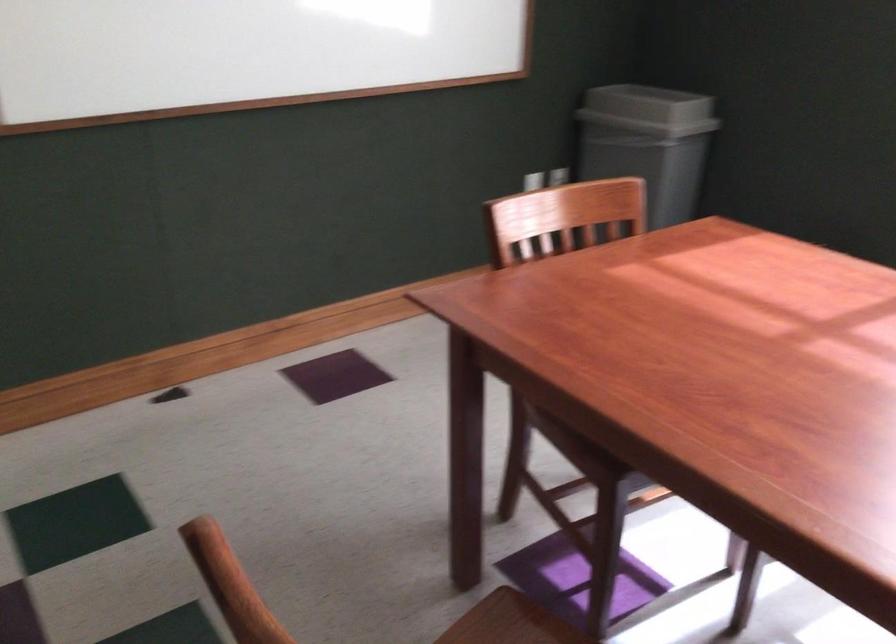
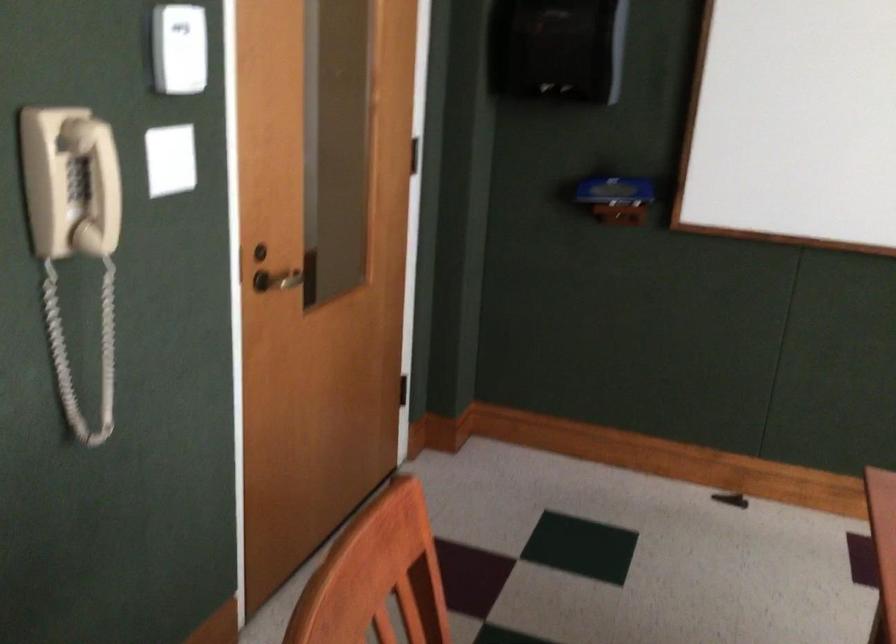
Question: The first image is from the beginning of the video and the second image is from the end. How did the camera likely rotate when shooting the video?

Choices:
 (A) Left
 (B) Right
 (C) Up
 (D) Down

Answer: (A)